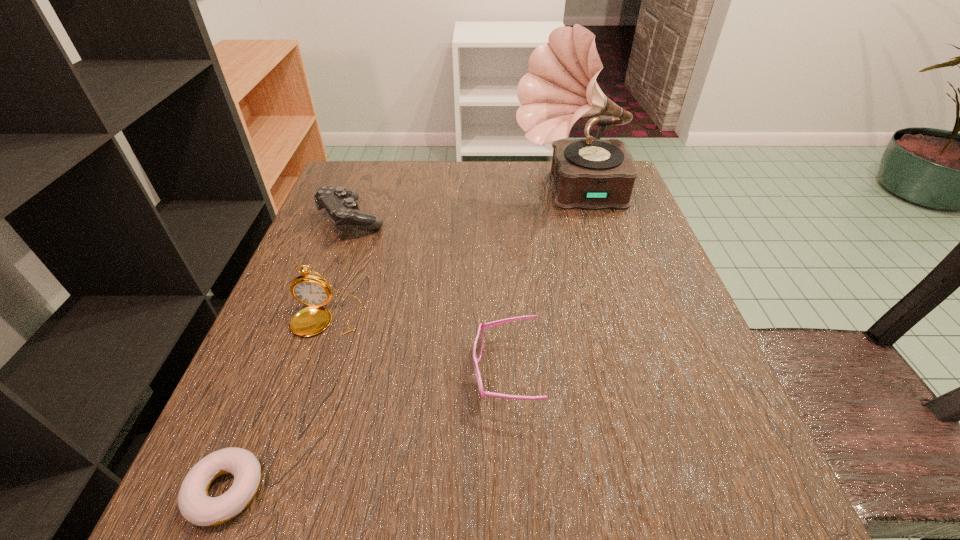
Select which object is the second closest to the sunglasses. Please provide its 2D coordinates. Your answer should be formatted as a tuple, i.e. [(x, y)], where the tuple contains the x and y coordinates of a point satisfying the conditions above.

[(195, 505)]

The height and width of the screenshot is (540, 960). I want to click on object identified as the third closest to the control, so click(478, 345).